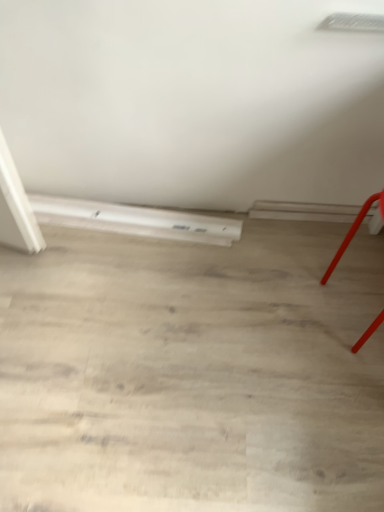
Find the location of a particular element. free space in front of smooth red chair at right is located at coordinates (342, 383).